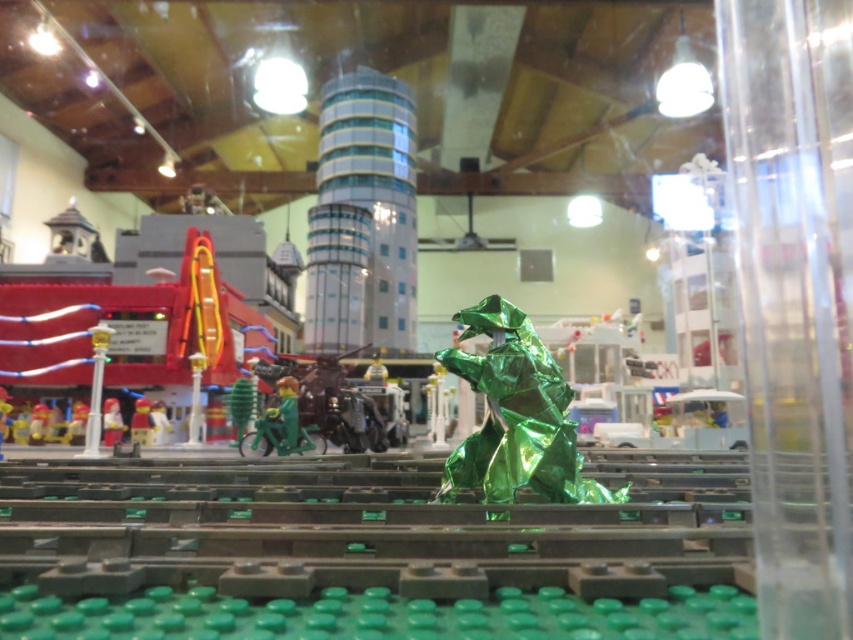
Question: Estimate the real-world distances between objects in this image. Which object is farther from the shiny metallic green dragon at center?

Choices:
 (A) brick red plastic minifigure at center
 (B) white glossy tower at center
 (C) smooth white figure at center

Answer: (B)

Question: Which object is farther from the camera taking this photo?

Choices:
 (A) green plastic bicycle at center
 (B) matte red toy car at left
 (C) smooth white figure at center

Answer: (C)

Question: Is the position of shiny metallic green dragon at center less distant than that of brick red plastic minifigure at center?

Choices:
 (A) no
 (B) yes

Answer: (B)

Question: Can you confirm if shiny metallic green dragon at center is wider than matte red toy car at left?

Choices:
 (A) no
 (B) yes

Answer: (B)

Question: Which point is closer to the camera?

Choices:
 (A) smooth white figure at center
 (B) green plastic bicycle at center
 (C) matte red toy car at left
 (D) brick red plastic minifigure at center

Answer: (B)

Question: Does white glossy tower at center have a larger size compared to shiny metallic green dragon at center?

Choices:
 (A) no
 (B) yes

Answer: (B)